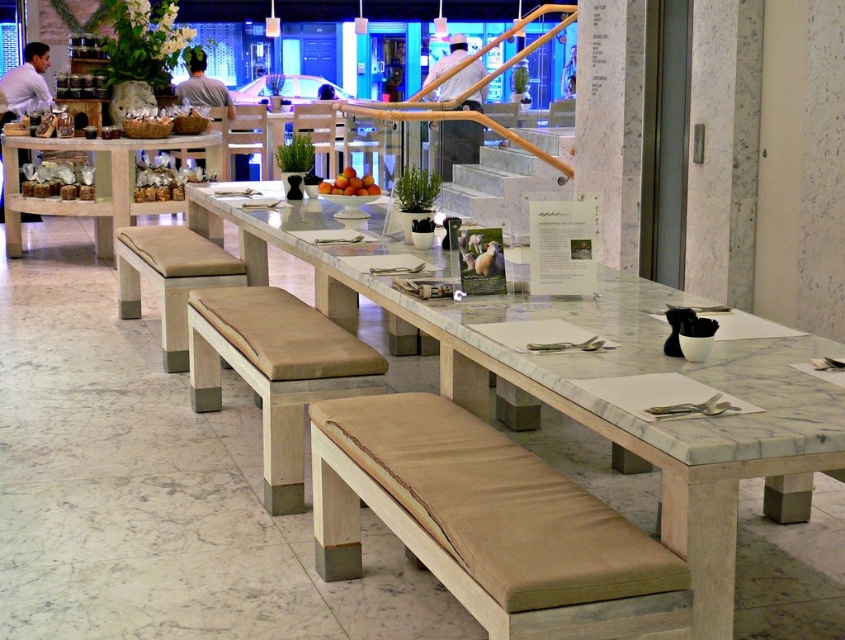
You are planning to seat guests at the dining table. The brown fabric bench at center and beige fabric bench at lower left are available. Which bench can accommodate more people?

The beige fabric bench at lower left can accommodate more people since it is larger than the brown fabric bench at center.

You are standing in front of the dining area and want to reach the white marble table at center. If your arm can extend 2.5 feet, can you reach the table without moving closer?

The distance between you and the white marble table at center is 6.45 feet, which is greater than your arm extension of 2.5 feet. Therefore, you cannot reach the table without moving closer.

You are standing at the entrance of the dining area and want to walk directly to the white marble table at center. According to the coordinates provided, in which direction should you move from your current position?

The white marble table at center is located at coordinates point (595, 378). Since you are at the entrance, you should move towards the direction of these coordinates to reach the table.